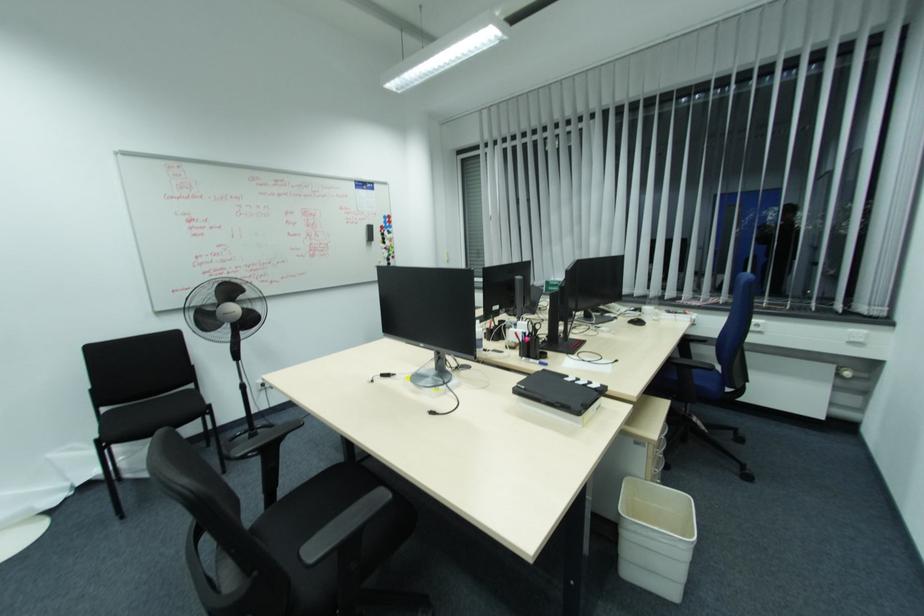
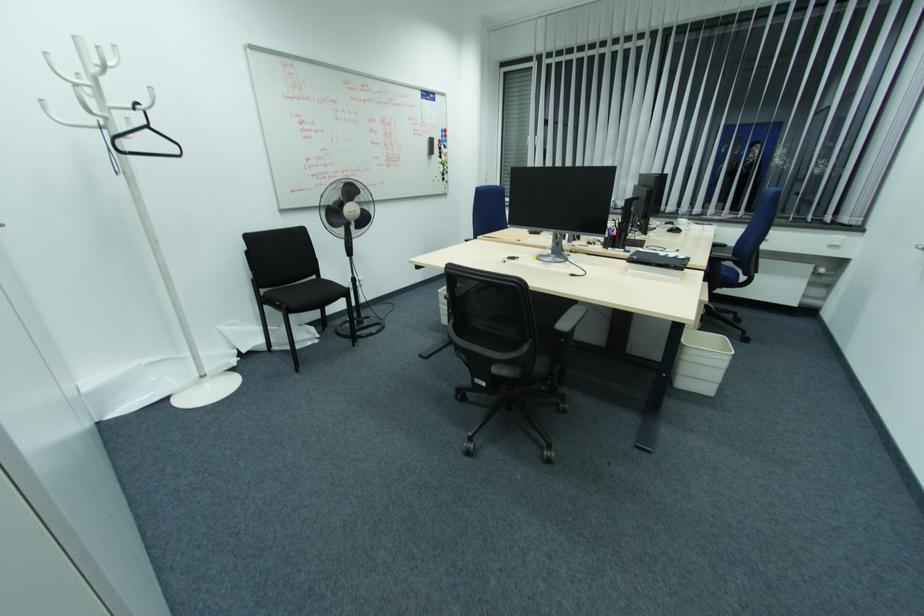
Locate, in the second image, the point that corresponds to the point at 103,411 in the first image.

(262, 291)